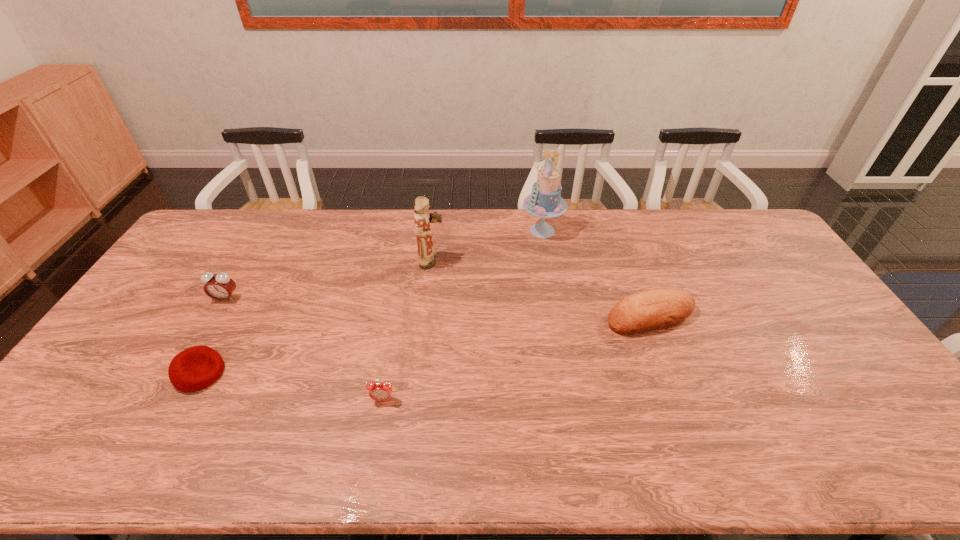
In the image, there is a desktop. Where is `vacant space at the near edge`? Image resolution: width=960 pixels, height=540 pixels. vacant space at the near edge is located at coordinates (835, 437).

The width and height of the screenshot is (960, 540). I want to click on free region at the left edge of the desktop, so click(107, 391).

In the image, there is a desktop. Where is `free space at the far left corner`? The width and height of the screenshot is (960, 540). free space at the far left corner is located at coordinates (216, 227).

This screenshot has height=540, width=960. What are the coordinates of `blank space at the far right corner of the desktop` in the screenshot? It's located at (757, 227).

Locate an element on the screen. The height and width of the screenshot is (540, 960). unoccupied position between the third tallest object and the bread is located at coordinates (438, 308).

Identify the location of vacant point located between the fifth farthest object and the farther alarm clock. This screenshot has width=960, height=540. (213, 336).

The height and width of the screenshot is (540, 960). What are the coordinates of `blank region between the figurine and the cake` in the screenshot? It's located at (487, 246).

Find the location of `free space that is in between the fifth farthest object and the bread`. free space that is in between the fifth farthest object and the bread is located at coordinates click(425, 345).

Image resolution: width=960 pixels, height=540 pixels. In order to click on unoccupied area between the tallest object and the left alarm clock in this screenshot , I will do `click(384, 265)`.

Where is `vacant area that lies between the fourth shortest object and the second farthest object`? This screenshot has width=960, height=540. vacant area that lies between the fourth shortest object and the second farthest object is located at coordinates (329, 281).